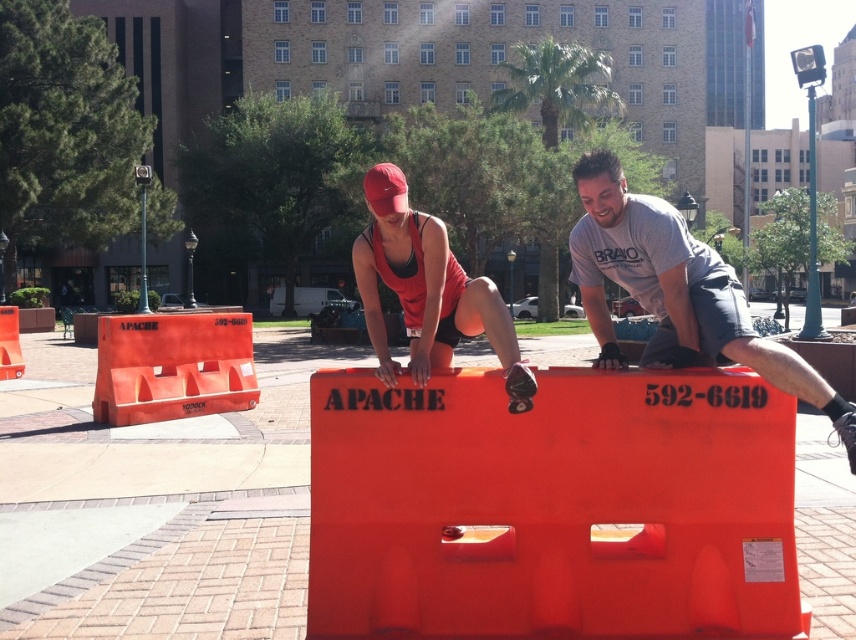
You are standing at the origin of the coordinate system in the park. You see the point at coordinates [676,292]. What object is located there?

The matte gray tshirt at center is located at point [676,292].

You are a park visitor trying to set up a small obstacle course using the orange plastic hurdle at center and the matte orange helmet at center. Which object should you place first if you want to start with the larger item?

The orange plastic hurdle at center should be placed first because it is larger than the matte orange helmet at center.